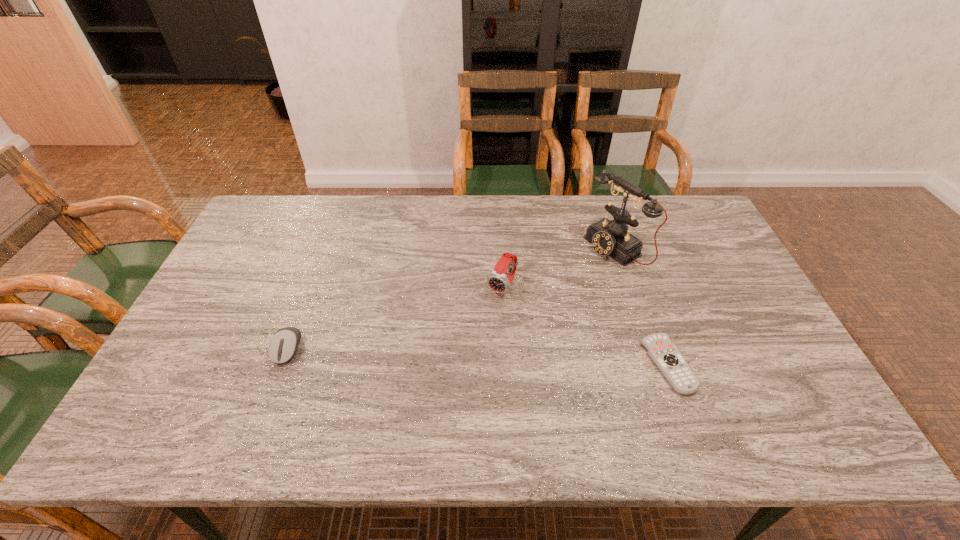
The height and width of the screenshot is (540, 960). Find the location of `empty location between the remote control and the third shortest object`. empty location between the remote control and the third shortest object is located at coordinates (586, 326).

I want to click on vacant region between the third object from right to left and the remote control, so click(x=586, y=326).

You are a GUI agent. You are given a task and a screenshot of the screen. Output one action in this format:
    pyautogui.click(x=<x>, y=<y>)
    Task: Click on the free spot between the tallest object and the second tallest object
    
    Given the screenshot: What is the action you would take?
    pyautogui.click(x=559, y=268)

In order to click on free area in between the shortest object and the telephone in this screenshot , I will do `click(641, 307)`.

Find the location of a particular element. This screenshot has height=540, width=960. empty space between the tallest object and the second tallest object is located at coordinates (559, 268).

The width and height of the screenshot is (960, 540). I want to click on empty location between the telephone and the watch, so click(x=559, y=268).

I want to click on vacant area that lies between the leftmost object and the second object from left to right, so click(395, 318).

Image resolution: width=960 pixels, height=540 pixels. What are the coordinates of `free space that is in between the tallest object and the leftmost object` in the screenshot? It's located at (451, 299).

Identify the location of vacant space in between the tallest object and the shortest object. The height and width of the screenshot is (540, 960). (641, 307).

Identify the location of free spot between the remote control and the tallest object. Image resolution: width=960 pixels, height=540 pixels. (641, 307).